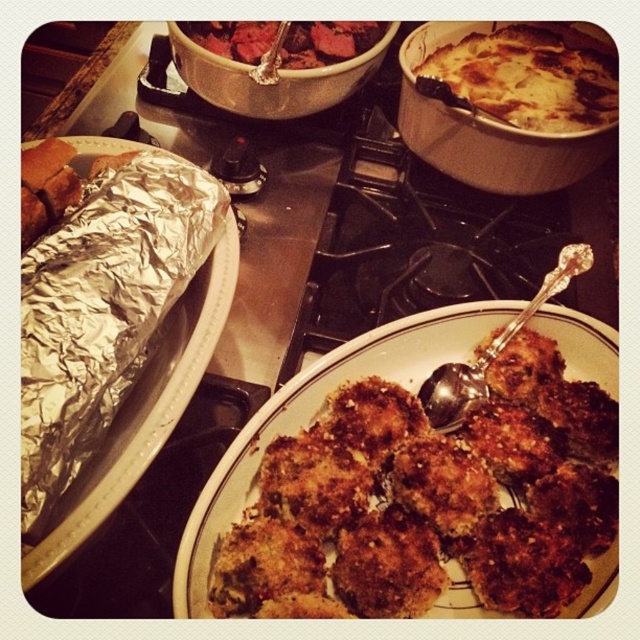
Question: Is golden-brown crispy chicken nuggets at center thinner than dark red meat at center?

Choices:
 (A) yes
 (B) no

Answer: (B)

Question: Observing the image, what is the correct spatial positioning of golden-brown cheesy casserole at upper right in reference to dark red meat at center?

Choices:
 (A) below
 (B) above

Answer: (A)

Question: Which point appears closest to the camera in this image?

Choices:
 (A) (216, 36)
 (B) (540, 33)
 (C) (352, 512)
 (D) (556, 285)

Answer: (C)

Question: Which of these objects is positioned farthest from the golden-brown cheesy casserole at upper right?

Choices:
 (A) golden-brown crispy chicken nuggets at center
 (B) silver metallic spoon at center-right

Answer: (A)

Question: Which of these objects is positioned farthest from the golden-brown crispy chicken nuggets at center?

Choices:
 (A) golden-brown cheesy casserole at upper right
 (B) dark red meat at center

Answer: (B)

Question: Is golden-brown crispy chicken nuggets at center positioned behind golden-brown cheesy casserole at upper right?

Choices:
 (A) yes
 (B) no

Answer: (B)